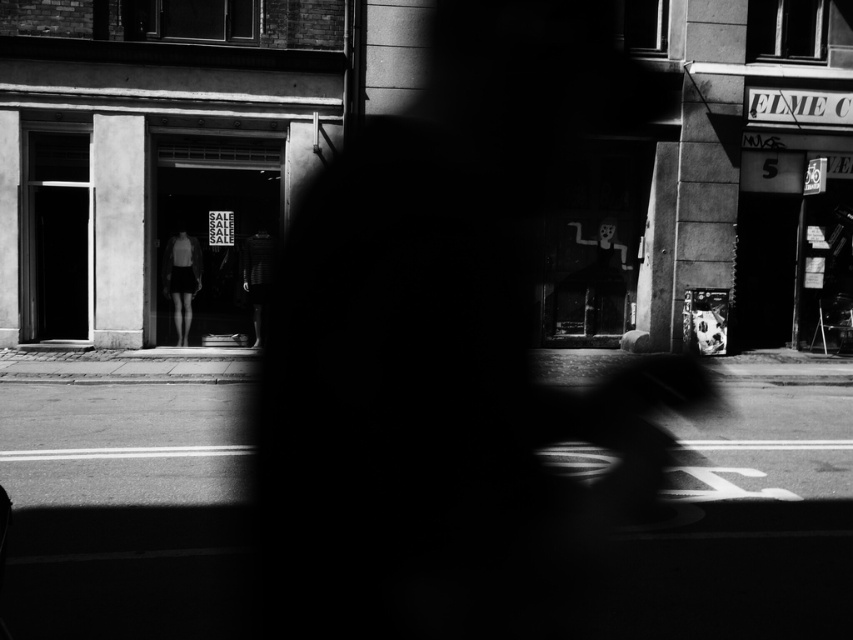
You are a photographer adjusting your camera settings to focus on two specific points in the image. The first point is at coordinates point (175, 328) and the second point is at point (254, 240). Which point should you focus on first if you want to ensure both points are in sharp focus?

You should focus on point (175, 328) first because it is closer to the camera than point (254, 240). This way, adjusting the focus from the closer point to the farther one ensures both are in sharp focus.